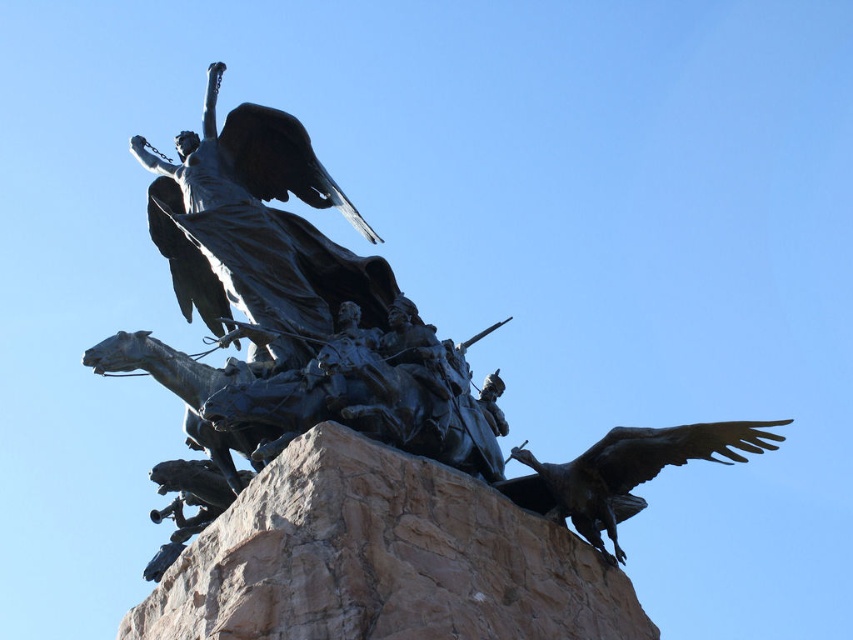
Question: Among these objects, which one is nearest to the camera?

Choices:
 (A) bronze eagle at lower right
 (B) bronze statue at center
 (C) brown rough stone at center

Answer: (C)

Question: Can you confirm if brown rough stone at center is wider than bronze eagle at lower right?

Choices:
 (A) no
 (B) yes

Answer: (A)

Question: Observing the image, what is the correct spatial positioning of brown rough stone at center in reference to bronze eagle at lower right?

Choices:
 (A) left
 (B) right

Answer: (A)

Question: Which object appears closest to the camera in this image?

Choices:
 (A) bronze statue at center
 (B) bronze eagle at lower right

Answer: (A)

Question: Which point is farther to the camera?

Choices:
 (A) (409, 490)
 (B) (585, 524)
 (C) (544, 461)

Answer: (C)

Question: Is bronze statue at center to the left of bronze eagle at lower right from the viewer's perspective?

Choices:
 (A) no
 (B) yes

Answer: (B)